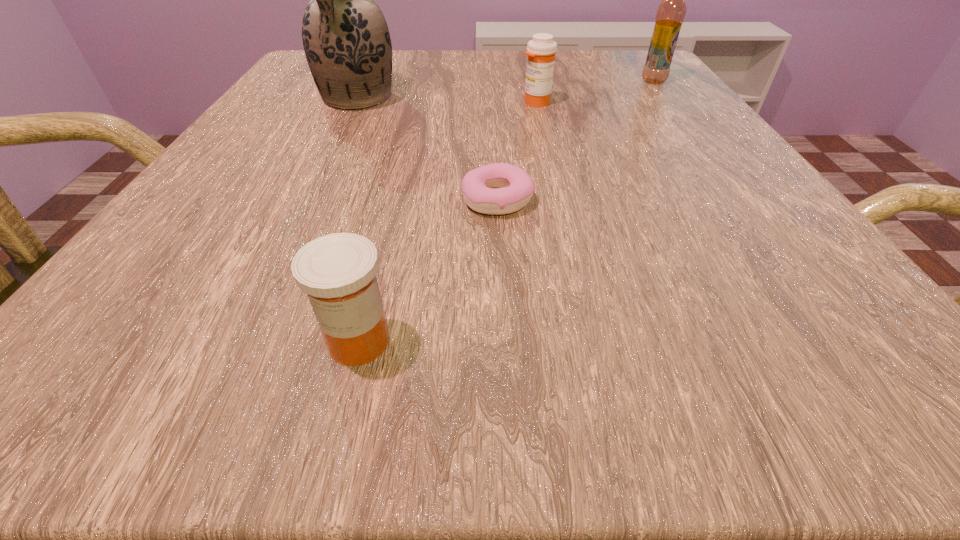
At what (x,y) coordinates should I click in order to perform the action: click on vacant point that satisfies the following two spatial constraints: 1. on the back side of the farther medicine; 2. on the left side of the second tallest object. Please return your answer as a coordinate pair (x, y). Looking at the image, I should click on (531, 81).

Locate an element on the screen. vacant space that satisfies the following two spatial constraints: 1. with the handle on the side of the shortest object; 2. on the left side of the tallest object is located at coordinates (308, 199).

Locate an element on the screen. Image resolution: width=960 pixels, height=540 pixels. blank space that satisfies the following two spatial constraints: 1. with the handle on the side of the vase; 2. on the left side of the third object from right to left is located at coordinates (308, 199).

Where is `vacant space that satisfies the following two spatial constraints: 1. with the handle on the side of the vase; 2. on the right side of the pastry`? The image size is (960, 540). vacant space that satisfies the following two spatial constraints: 1. with the handle on the side of the vase; 2. on the right side of the pastry is located at coordinates (308, 199).

This screenshot has height=540, width=960. Find the location of `blank space that satisfies the following two spatial constraints: 1. with the handle on the side of the farther medicine; 2. on the left side of the tallest object`. blank space that satisfies the following two spatial constraints: 1. with the handle on the side of the farther medicine; 2. on the left side of the tallest object is located at coordinates (356, 103).